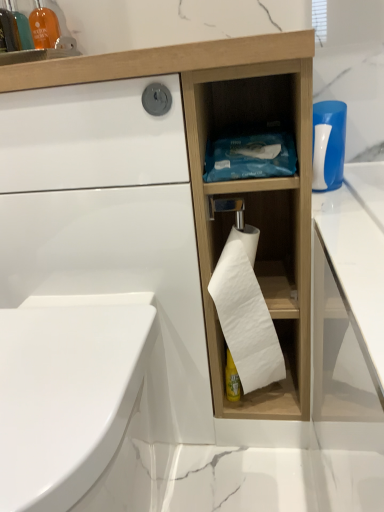
Question: Considering the relative sizes of translucent orange bottle at upper left and white glossy bidet at lower left in the image provided, is translucent orange bottle at upper left taller than white glossy bidet at lower left?

Choices:
 (A) yes
 (B) no

Answer: (B)

Question: Considering the relative sizes of translucent orange bottle at upper left and white glossy bidet at lower left in the image provided, is translucent orange bottle at upper left wider than white glossy bidet at lower left?

Choices:
 (A) no
 (B) yes

Answer: (A)

Question: Is translucent orange bottle at upper left surrounding white glossy bidet at lower left?

Choices:
 (A) yes
 (B) no

Answer: (B)

Question: Can you confirm if translucent orange bottle at upper left is smaller than white glossy bidet at lower left?

Choices:
 (A) yes
 (B) no

Answer: (A)

Question: From the image's perspective, is translucent orange bottle at upper left beneath white glossy bidet at lower left?

Choices:
 (A) yes
 (B) no

Answer: (B)

Question: Considering the positions of point (319, 159) and point (3, 24), is point (319, 159) closer or farther from the camera than point (3, 24)?

Choices:
 (A) farther
 (B) closer

Answer: (B)

Question: In the image, is white plastic bottle at upper right on the left side or the right side of translucent orange bottle at upper left?

Choices:
 (A) left
 (B) right

Answer: (B)

Question: Considering the positions of white plastic bottle at upper right and translucent orange bottle at upper left in the image, is white plastic bottle at upper right bigger or smaller than translucent orange bottle at upper left?

Choices:
 (A) big
 (B) small

Answer: (A)

Question: In terms of width, does white plastic bottle at upper right look wider or thinner when compared to translucent orange bottle at upper left?

Choices:
 (A) wide
 (B) thin

Answer: (A)

Question: From a real-world perspective, relative to white matte toilet paper at center, is white glossy bidet at lower left vertically above or below?

Choices:
 (A) above
 (B) below

Answer: (B)

Question: In terms of width, does white glossy bidet at lower left look wider or thinner when compared to white matte toilet paper at center?

Choices:
 (A) wide
 (B) thin

Answer: (A)

Question: Choose the correct answer: Is white glossy bidet at lower left inside white matte toilet paper at center or outside it?

Choices:
 (A) outside
 (B) inside

Answer: (A)

Question: Does point (3, 369) appear closer or farther from the camera than point (266, 357)?

Choices:
 (A) farther
 (B) closer

Answer: (B)

Question: Considering the positions of white glossy bidet at lower left and matte orange glass at upper left in the image, is white glossy bidet at lower left bigger or smaller than matte orange glass at upper left?

Choices:
 (A) big
 (B) small

Answer: (A)

Question: Considering the relative positions of white glossy bidet at lower left and matte orange glass at upper left in the image provided, is white glossy bidet at lower left to the left or to the right of matte orange glass at upper left?

Choices:
 (A) left
 (B) right

Answer: (B)